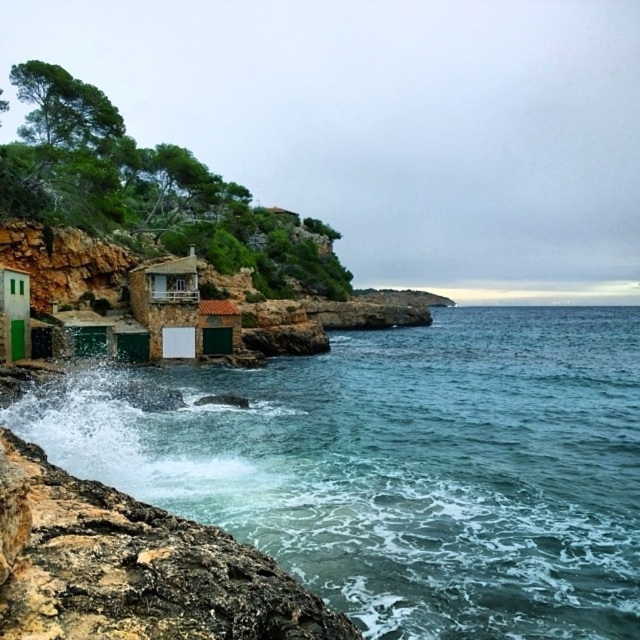
How far apart are blue-green liquid at lower center and green matte hut at lower center?

blue-green liquid at lower center is 60.80 feet from green matte hut at lower center.

Is blue-green liquid at lower center shorter than green matte hut at lower center?

In fact, blue-green liquid at lower center may be taller than green matte hut at lower center.

At what (x,y) coordinates should I click in order to perform the action: click on blue-green liquid at lower center. Please return your answer as a coordinate pair (x, y). This screenshot has width=640, height=640. Looking at the image, I should click on (400, 467).

Between blue-green liquid at lower center and green matte door at lower left, which one is positioned higher?

green matte door at lower left

Is point (570, 632) in front of point (4, 332)?

Yes.

Who is more distant from viewer, (x=388, y=541) or (x=13, y=269)?

Point (x=13, y=269)

Where is `blue-green liquid at lower center`? The height and width of the screenshot is (640, 640). blue-green liquid at lower center is located at coordinates (400, 467).

Can you confirm if green matte door at lower left is positioned to the left of green matte hut at lower center?

Indeed, green matte door at lower left is positioned on the left side of green matte hut at lower center.

Which is below, green matte door at lower left or green matte hut at lower center?

green matte door at lower left is lower down.

At what (x,y) coordinates should I click in order to perform the action: click on green matte door at lower left. Please return your answer as a coordinate pair (x, y). The image size is (640, 640). Looking at the image, I should click on (13, 314).

Identify the location of green matte door at lower left. (13, 314).